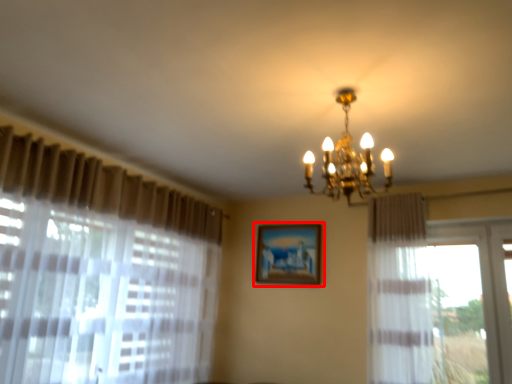
Question: From the image's perspective, where is picture frame (annotated by the red box) located relative to lamp?

Choices:
 (A) above
 (B) below

Answer: (B)